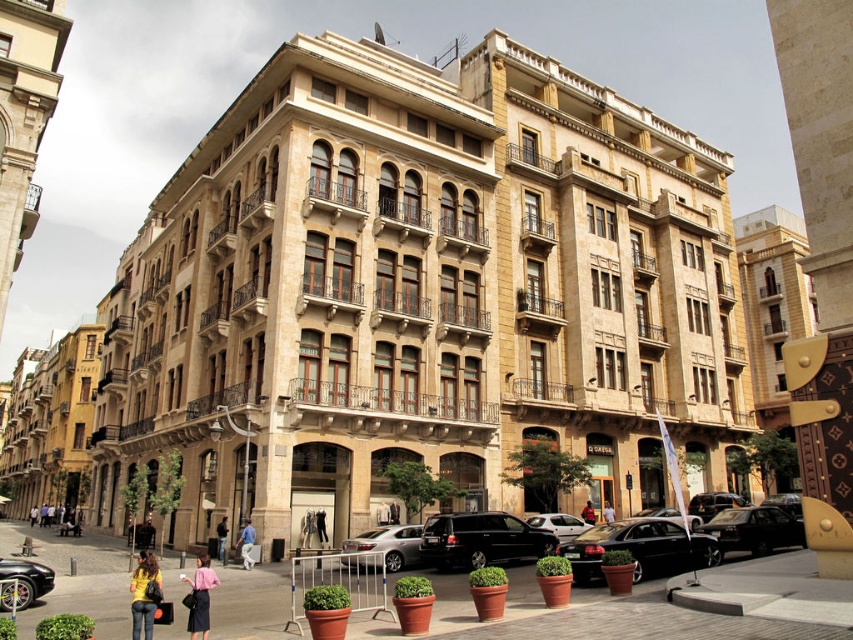
You are a customer trying to decide between two outfits displayed in a store window. The store window displays the matte pink skirt at lower center and the dark blue jeans at center. Which outfit takes up more horizontal space in the window?

The matte pink skirt at lower center takes up more horizontal space in the window since its width surpasses that of the dark blue jeans at center.

You are a delivery person who needs to park your black glossy car at lower right in a parking spot that can only accommodate vehicles shorter than the yellow matte shirt at lower left. Can your car fit in the spot?

The black glossy car at lower right is shorter than the yellow matte shirt at lower left, so it can fit in the parking spot.

You are a delivery person trying to park your vehicle in the plaza in front of the building. You see a shiny black sedan at center and a black glossy car at lower right. Which vehicle has a wider body to consider for parking space?

The shiny black sedan at center has a wider body than the black glossy car at lower right, so you should consider its width when planning your parking space.